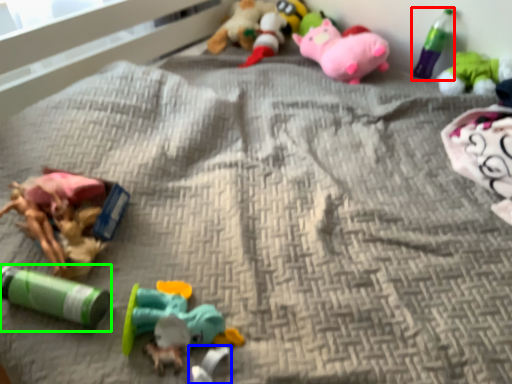
Question: Which object is the closest to the bottle (highlighted by a red box)? Choose among these: toy (highlighted by a blue box) or toy (highlighted by a green box).

Choices:
 (A) toy
 (B) toy

Answer: (A)